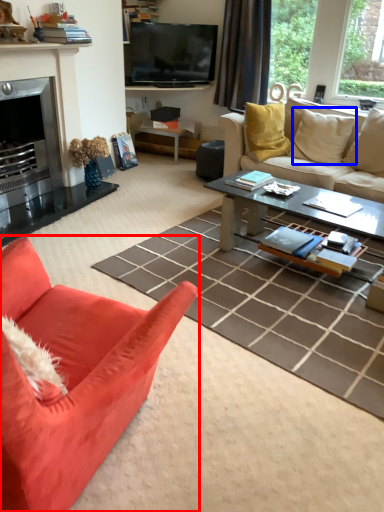
Question: Which object is closer to the camera taking this photo, studio couch (highlighted by a red box) or pillow (highlighted by a blue box)?

Choices:
 (A) studio couch
 (B) pillow

Answer: (A)